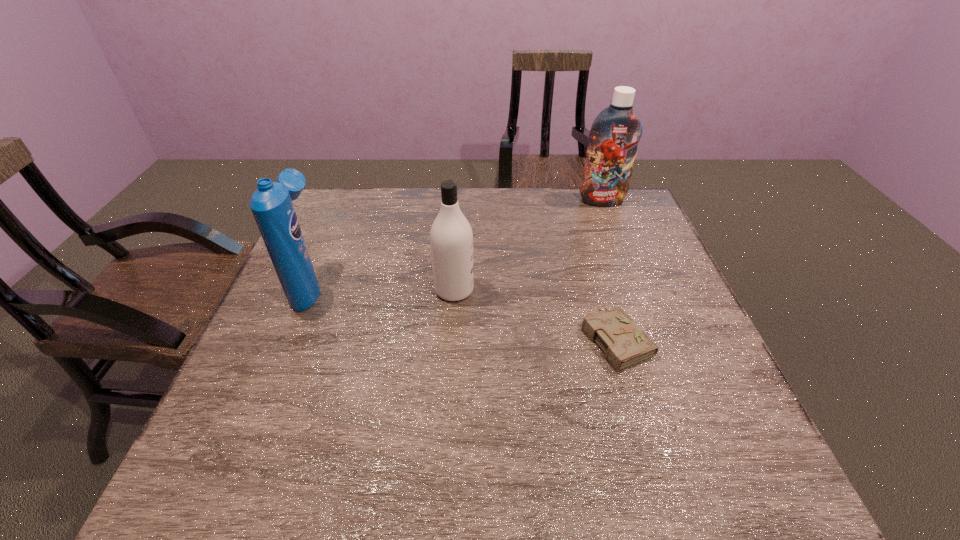
You are a GUI agent. You are given a task and a screenshot of the screen. Output one action in this format:
    pyautogui.click(x=<x>, y=<y>)
    Task: Click on the farthest object
    Image resolution: width=960 pixels, height=540 pixels.
    Given the screenshot: What is the action you would take?
    pyautogui.click(x=614, y=135)

Identify the location of the rightmost shampoo. The height and width of the screenshot is (540, 960). (614, 135).

Locate an element on the screen. The height and width of the screenshot is (540, 960). the leftmost shampoo is located at coordinates pos(271,203).

Identify the location of the third object from right to left. (451, 238).

This screenshot has height=540, width=960. Identify the location of the shortest object. coord(625,344).

Identify the location of free space located 0.350m on the front label of the farthest object. (633, 281).

Locate an element on the screen. This screenshot has width=960, height=540. vacant space located 0.130m on the back of the leftmost object is located at coordinates (331, 234).

You are a GUI agent. You are given a task and a screenshot of the screen. Output one action in this format:
    pyautogui.click(x=<x>, y=<y>)
    Task: Click on the free location located 0.210m on the front-facing side of the second shampoo from right to left
    This screenshot has width=960, height=540.
    Given the screenshot: What is the action you would take?
    pyautogui.click(x=555, y=290)

Locate an element on the screen. Image resolution: width=960 pixels, height=540 pixels. free space located 0.160m on the left of the diary is located at coordinates (514, 338).

Locate an element on the screen. This screenshot has width=960, height=540. object that is at the far edge is located at coordinates (614, 135).